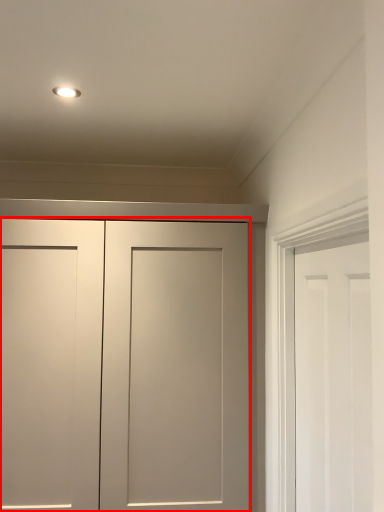
Question: Observing the image, what is the correct spatial positioning of door (annotated by the red box) in reference to door?

Choices:
 (A) left
 (B) right

Answer: (A)